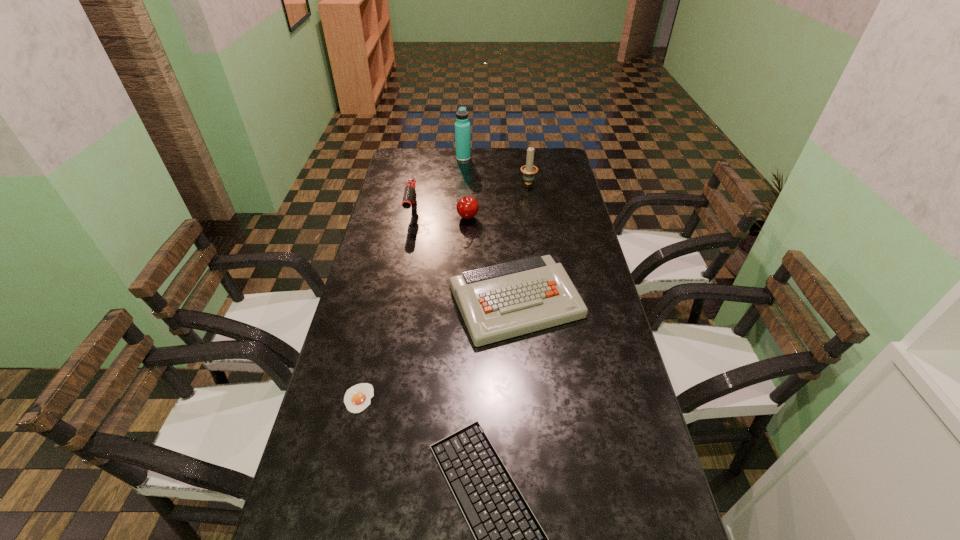
Find the location of a particular element. This screenshot has height=540, width=960. blank region between the cherry and the gun is located at coordinates (440, 215).

The width and height of the screenshot is (960, 540). I want to click on free space between the shortest object and the candle_holder, so click(444, 291).

Find the location of a particular element. free space between the candle_holder and the farthest object is located at coordinates (495, 170).

The width and height of the screenshot is (960, 540). What are the coordinates of `empty space that is in between the cherry and the gun` in the screenshot? It's located at (440, 215).

Identify the location of object that can be found as the third closest to the sixth tallest object. This screenshot has height=540, width=960. (467, 207).

Identify the location of object that stands as the closest to the cherry. The height and width of the screenshot is (540, 960). (409, 198).